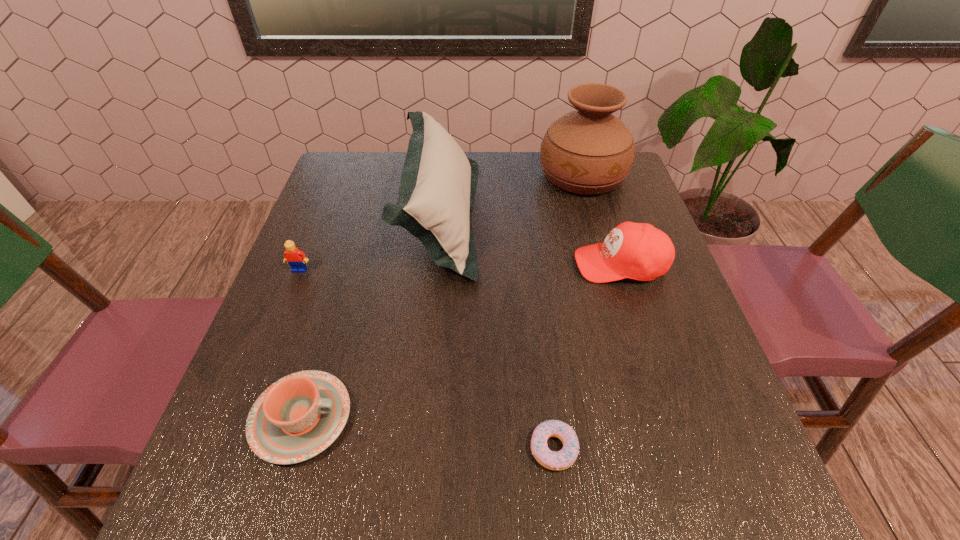
This screenshot has height=540, width=960. What are the coordinates of `vacant point located between the third object from right to left and the chinaware` in the screenshot? It's located at (427, 433).

The width and height of the screenshot is (960, 540). In order to click on empty location between the Lego and the shortest object in this screenshot , I will do `click(426, 359)`.

Find the location of a particular element. The height and width of the screenshot is (540, 960). free spot between the third tallest object and the tallest object is located at coordinates (601, 220).

Find the location of a particular element. This screenshot has height=540, width=960. vacant point located between the third object from right to left and the urn is located at coordinates (568, 312).

Find the location of a particular element. The height and width of the screenshot is (540, 960). vacant space in between the fourth tallest object and the chinaware is located at coordinates (300, 344).

This screenshot has width=960, height=540. Find the location of `free space that is in between the third object from right to left and the fifth shortest object`. free space that is in between the third object from right to left and the fifth shortest object is located at coordinates (497, 333).

The width and height of the screenshot is (960, 540). Identify the location of free area in between the fifth tallest object and the doughnut. (427, 433).

Find the location of `vacant area that lies between the chinaware and the baseball cap`. vacant area that lies between the chinaware and the baseball cap is located at coordinates pos(461,341).

Identify the location of free space between the fifth shortest object and the fourth tallest object. This screenshot has width=960, height=540. (371, 244).

Where is `object identified as the third closest to the baseball cap`? This screenshot has width=960, height=540. object identified as the third closest to the baseball cap is located at coordinates (563, 459).